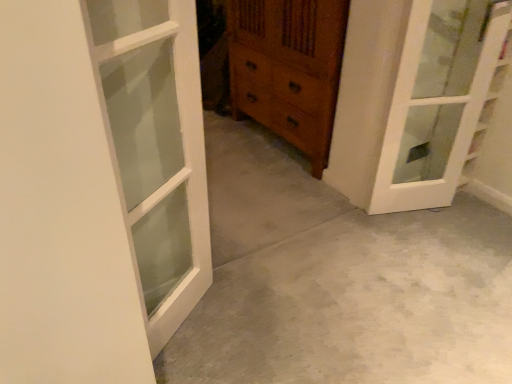
Question: Does wooden chest of drawers at center have a smaller size compared to white glass door at upper right, acting as the second door starting from the left?

Choices:
 (A) yes
 (B) no

Answer: (B)

Question: Is wooden chest of drawers at center positioned before white glass door at upper right, placed as the second door when sorted from front to back?

Choices:
 (A) yes
 (B) no

Answer: (B)

Question: Is wooden chest of drawers at center beside white glass door at upper right, acting as the second door starting from the left?

Choices:
 (A) yes
 (B) no

Answer: (B)

Question: Can you confirm if wooden chest of drawers at center is thinner than white glass door at upper right, which is counted as the first door, starting from the right?

Choices:
 (A) no
 (B) yes

Answer: (A)

Question: From the image's perspective, does wooden chest of drawers at center appear lower than white glass door at upper right, which is counted as the first door, starting from the right?

Choices:
 (A) yes
 (B) no

Answer: (B)

Question: Does point (439, 306) appear closer or farther from the camera than point (249, 21)?

Choices:
 (A) closer
 (B) farther

Answer: (A)

Question: In the image, is gray concrete at center on the left side or the right side of wooden chest of drawers at center?

Choices:
 (A) left
 (B) right

Answer: (B)

Question: From a real-world perspective, relative to wooden chest of drawers at center, is gray concrete at center vertically above or below?

Choices:
 (A) below
 (B) above

Answer: (A)

Question: In terms of width, does gray concrete at center look wider or thinner when compared to wooden chest of drawers at center?

Choices:
 (A) wide
 (B) thin

Answer: (A)

Question: In terms of width, does gray concrete at center look wider or thinner when compared to white glass door at upper right, which is counted as the first door, starting from the right?

Choices:
 (A) thin
 (B) wide

Answer: (B)

Question: Is point (292, 309) positioned closer to the camera than point (420, 13)?

Choices:
 (A) farther
 (B) closer

Answer: (A)

Question: From a real-world perspective, is gray concrete at center physically located above or below white glass door at upper right, placed as the second door when sorted from front to back?

Choices:
 (A) below
 (B) above

Answer: (A)

Question: In the image, is gray concrete at center positioned in front of or behind white glass door at upper right, acting as the second door starting from the left?

Choices:
 (A) front
 (B) behind

Answer: (A)

Question: Considering the relative positions of wooden chest of drawers at center and white glass door at upper right, acting as the second door starting from the left, in the image provided, is wooden chest of drawers at center to the left or to the right of white glass door at upper right, acting as the second door starting from the left,?

Choices:
 (A) right
 (B) left

Answer: (B)

Question: From their relative heights in the image, would you say wooden chest of drawers at center is taller or shorter than white glass door at upper right, placed as the second door when sorted from front to back?

Choices:
 (A) tall
 (B) short

Answer: (B)